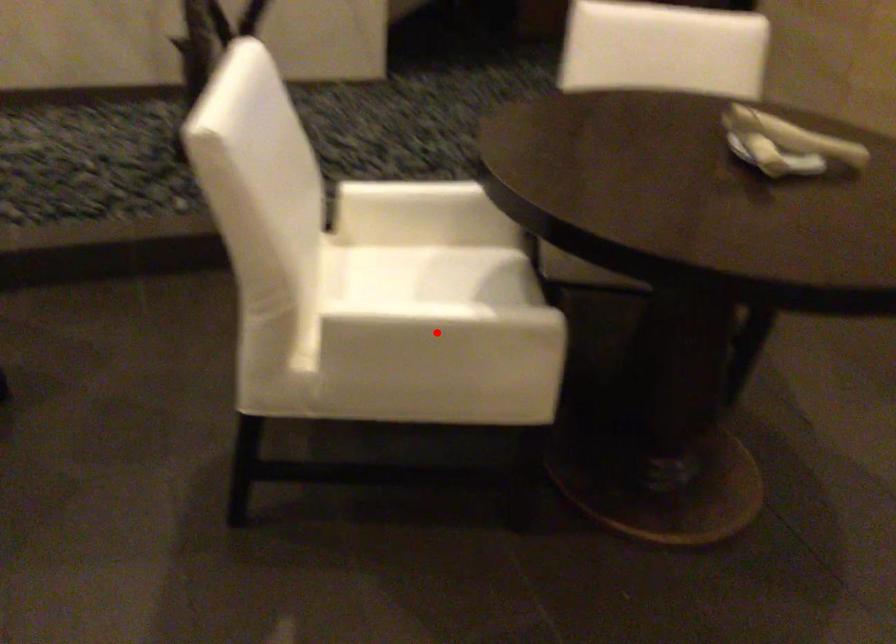
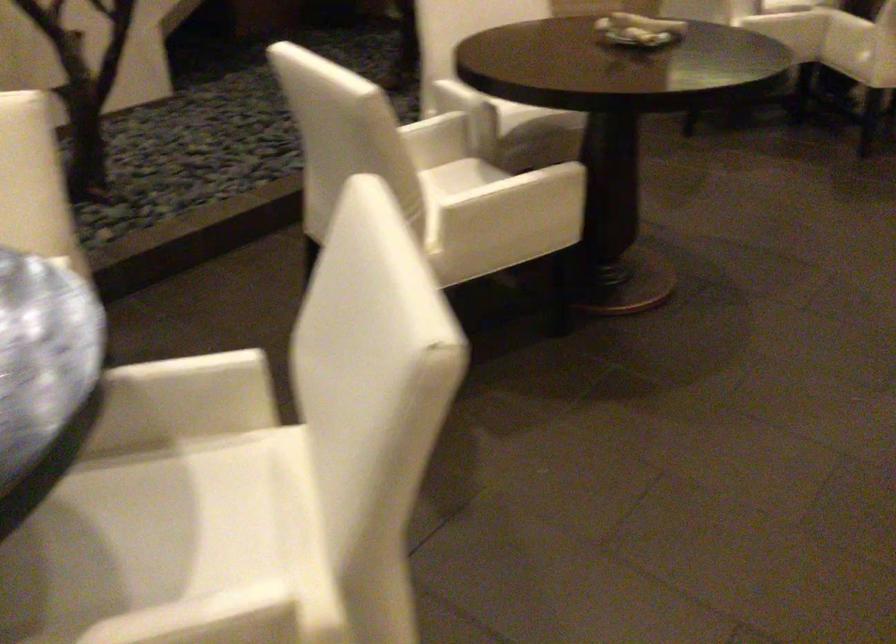
Question: I am providing you with two images of the same scene from different viewpoints. A red point is shown in image1. For the corresponding object point in image2, is it positioned nearer or farther from the camera?

Choices:
 (A) Nearer
 (B) Farther

Answer: (B)